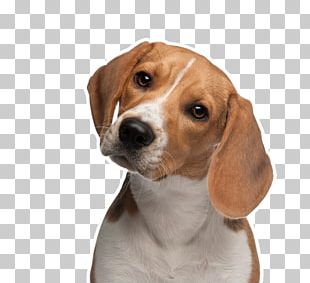
Where is `the chest`? Image resolution: width=310 pixels, height=283 pixels. the chest is located at coordinates (160, 258).